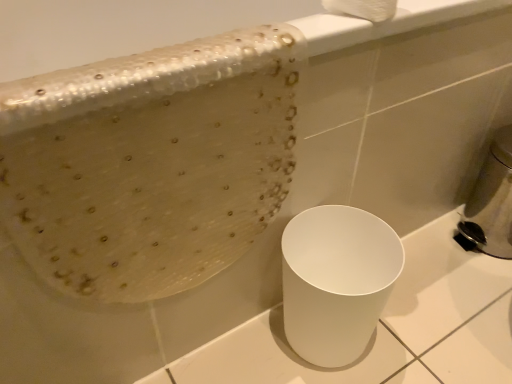
What is the approximate width of white fluffy toilet paper at upper center?

white fluffy toilet paper at upper center is 3.50 inches wide.

The width and height of the screenshot is (512, 384). What do you see at coordinates (362, 9) in the screenshot?
I see `white fluffy toilet paper at upper center` at bounding box center [362, 9].

Image resolution: width=512 pixels, height=384 pixels. What are the coordinates of `metallic silver soap dispenser at right` in the screenshot? It's located at (490, 203).

Could white fluffy toilet paper at upper center be considered to be inside white glossy trash can at lower right?

No, white fluffy toilet paper at upper center is not inside white glossy trash can at lower right.

Can you confirm if white glossy trash can at lower right is wider than white fluffy toilet paper at upper center?

Yes.

Would you consider white glossy trash can at lower right to be distant from white fluffy toilet paper at upper center?

No.

Is white glossy trash can at lower right facing away from white fluffy toilet paper at upper center?

No, white glossy trash can at lower right is not facing away from white fluffy toilet paper at upper center.

Which of these two, white fluffy toilet paper at upper center or metallic silver soap dispenser at right, is smaller?

With smaller size is white fluffy toilet paper at upper center.

Is point (368, 3) closer to viewer compared to point (474, 236)?

Yes, it is in front of point (474, 236).

Which object is closer to the camera taking this photo, white fluffy toilet paper at upper center or metallic silver soap dispenser at right?

white fluffy toilet paper at upper center is in front.

Considering the sizes of white fluffy toilet paper at upper center and white glossy trash can at lower right in the image, is white fluffy toilet paper at upper center wider or thinner than white glossy trash can at lower right?

In the image, white fluffy toilet paper at upper center appears to be more narrow than white glossy trash can at lower right.

Is white fluffy toilet paper at upper center positioned far away from white glossy trash can at lower right?

Actually, white fluffy toilet paper at upper center and white glossy trash can at lower right are a little close together.

Identify the location of porcelain below the white fluffy toilet paper at upper center (from the image's perspective). The image size is (512, 384). (336, 281).

In terms of size, does white fluffy toilet paper at upper center appear bigger or smaller than white glossy trash can at lower right?

Considering their sizes, white fluffy toilet paper at upper center takes up less space than white glossy trash can at lower right.

This screenshot has width=512, height=384. I want to click on porcelain that appears below the metallic silver soap dispenser at right (from a real-world perspective), so click(336, 281).

Which is closer, (507, 179) or (335, 308)?

Point (335, 308)

Considering the relative positions of metallic silver soap dispenser at right and white glossy trash can at lower right in the image provided, is metallic silver soap dispenser at right to the left of white glossy trash can at lower right from the viewer's perspective?

No, metallic silver soap dispenser at right is not to the left of white glossy trash can at lower right.

Consider the image. Is there a large distance between white glossy trash can at lower right and metallic silver soap dispenser at right?

They are positioned close to each other.

Which is less distant, (353, 318) or (504, 193)?

The point (353, 318) is in front.

Considering the positions of objects white glossy trash can at lower right and metallic silver soap dispenser at right in the image provided, who is more to the left, white glossy trash can at lower right or metallic silver soap dispenser at right?

white glossy trash can at lower right is more to the left.

Is metallic silver soap dispenser at right at the back of white glossy trash can at lower right?

No, white glossy trash can at lower right is not facing away from metallic silver soap dispenser at right.

Does metallic silver soap dispenser at right touch white fluffy toilet paper at upper center?

metallic silver soap dispenser at right and white fluffy toilet paper at upper center are clearly separated.

Looking at this image, considering the relative sizes of metallic silver soap dispenser at right and white fluffy toilet paper at upper center in the image provided, is metallic silver soap dispenser at right bigger than white fluffy toilet paper at upper center?

Correct, metallic silver soap dispenser at right is larger in size than white fluffy toilet paper at upper center.

Considering the sizes of objects metallic silver soap dispenser at right and white fluffy toilet paper at upper center in the image provided, who is shorter, metallic silver soap dispenser at right or white fluffy toilet paper at upper center?

Standing shorter between the two is white fluffy toilet paper at upper center.

Where is `toilet paper that is on the right side of white glossy trash can at lower right`? toilet paper that is on the right side of white glossy trash can at lower right is located at coordinates (362, 9).

You are a GUI agent. You are given a task and a screenshot of the screen. Output one action in this format:
    pyautogui.click(x=<x>, y=<y>)
    Task: Click on the toilet paper in front of the metallic silver soap dispenser at right
    The width and height of the screenshot is (512, 384).
    Given the screenshot: What is the action you would take?
    pyautogui.click(x=362, y=9)

Considering their positions, is metallic silver soap dispenser at right positioned closer to white fluffy toilet paper at upper center than white glossy trash can at lower right?

Among the two, white glossy trash can at lower right is located nearer to white fluffy toilet paper at upper center.

Based on their spatial positions, is white fluffy toilet paper at upper center or metallic silver soap dispenser at right closer to white glossy trash can at lower right?

white fluffy toilet paper at upper center is closer to white glossy trash can at lower right.

Estimate the real-world distances between objects in this image. Which object is further from metallic silver soap dispenser at right, white fluffy toilet paper at upper center or white glossy trash can at lower right?

white fluffy toilet paper at upper center is positioned further to the anchor metallic silver soap dispenser at right.

Estimate the real-world distances between objects in this image. Which object is further from white glossy trash can at lower right, metallic silver soap dispenser at right or white fluffy toilet paper at upper center?

Among the two, metallic silver soap dispenser at right is located further to white glossy trash can at lower right.

Based on their spatial positions, is white glossy trash can at lower right or metallic silver soap dispenser at right closer to white fluffy toilet paper at upper center?

white glossy trash can at lower right lies closer to white fluffy toilet paper at upper center than the other object.

Looking at the image, which one is located closer to metallic silver soap dispenser at right, white glossy trash can at lower right or white fluffy toilet paper at upper center?

white glossy trash can at lower right.

Identify the location of toilet paper between white glossy trash can at lower right and metallic silver soap dispenser at right from left to right. This screenshot has width=512, height=384. (362, 9).